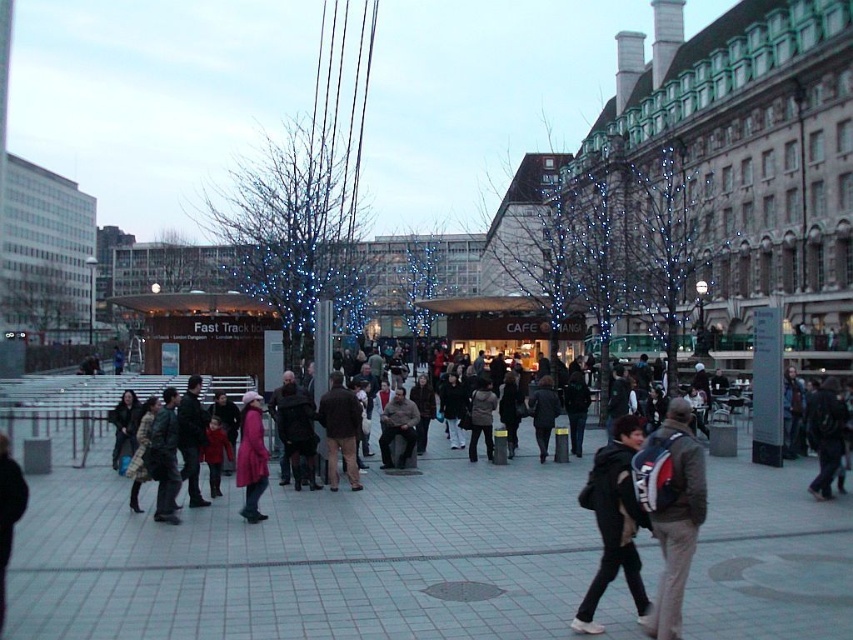
Is matte black jacket at center positioned in front of matte black backpack at center?

Yes, it is.

Is matte black jacket at center to the right of matte black backpack at center from the viewer's perspective?

Incorrect, matte black jacket at center is not on the right side of matte black backpack at center.

The height and width of the screenshot is (640, 853). I want to click on matte black jacket at center, so pos(318,561).

The image size is (853, 640). What are the coordinates of `matte black jacket at center` in the screenshot? It's located at (318, 561).

Locate an element on the screen. black matte jacket at lower right is located at coordinates (614, 522).

Does black matte jacket at lower right appear over pink fabric coat at center?

Indeed, black matte jacket at lower right is positioned over pink fabric coat at center.

What do you see at coordinates (614, 522) in the screenshot? This screenshot has width=853, height=640. I see `black matte jacket at lower right` at bounding box center [614, 522].

The height and width of the screenshot is (640, 853). Find the location of `black matte jacket at lower right`. black matte jacket at lower right is located at coordinates (614, 522).

How far apart are pink fabric coat at center and brown leather jacket at center?

They are 44.29 feet apart.

Can you confirm if pink fabric coat at center is wider than brown leather jacket at center?

Yes, pink fabric coat at center is wider than brown leather jacket at center.

Which is in front, point (236, 477) or point (408, 442)?

Point (236, 477) is in front.

Where is `pink fabric coat at center`? The image size is (853, 640). pink fabric coat at center is located at coordinates (x=251, y=458).